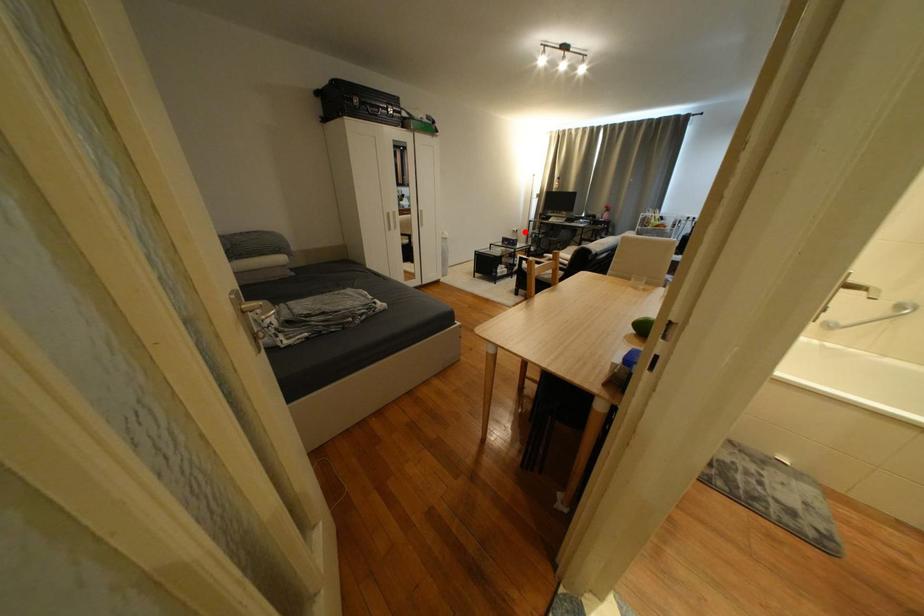
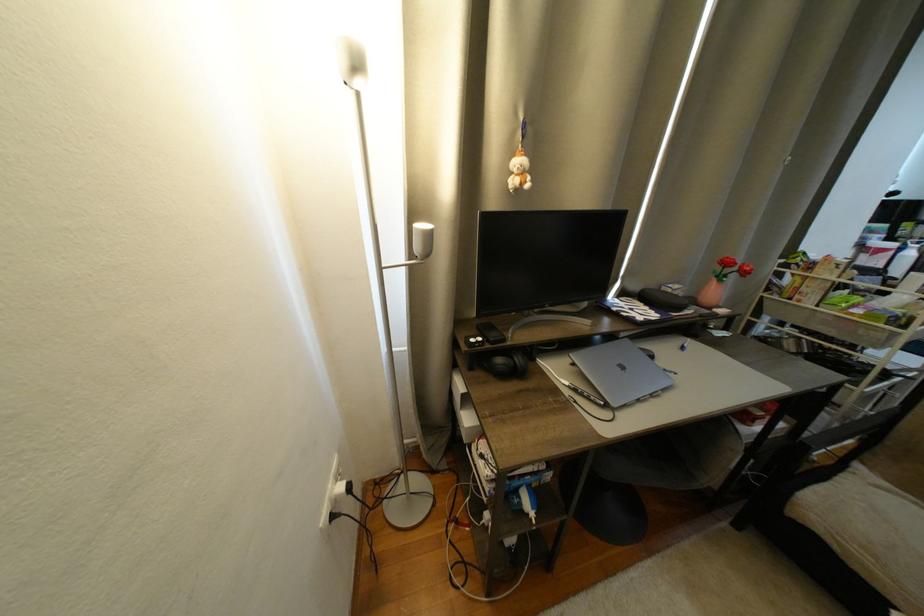
The point at the highlighted location is marked in the first image. Where is the corresponding point in the second image?

(358, 490)